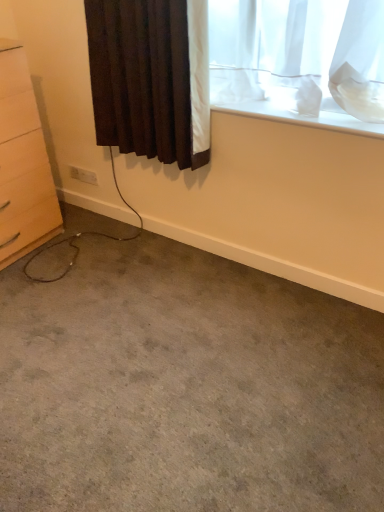
Question: Is white matte window sill at upper right thinner than brown textured curtain at upper left?

Choices:
 (A) no
 (B) yes

Answer: (A)

Question: From a real-world perspective, is white matte window sill at upper right on brown textured curtain at upper left?

Choices:
 (A) yes
 (B) no

Answer: (B)

Question: Considering the relative positions of white matte window sill at upper right and brown textured curtain at upper left in the image provided, is white matte window sill at upper right in front of brown textured curtain at upper left?

Choices:
 (A) yes
 (B) no

Answer: (B)

Question: Can you confirm if white matte window sill at upper right is positioned to the right of brown textured curtain at upper left?

Choices:
 (A) yes
 (B) no

Answer: (A)

Question: Is white matte window sill at upper right positioned with its back to brown textured curtain at upper left?

Choices:
 (A) yes
 (B) no

Answer: (B)

Question: From a real-world perspective, is white matte window sill at upper right below brown textured curtain at upper left?

Choices:
 (A) yes
 (B) no

Answer: (A)

Question: From a real-world perspective, is gray carpet at lower center located beneath light wood chest of drawers at left?

Choices:
 (A) yes
 (B) no

Answer: (A)

Question: Is gray carpet at lower center to the right of light wood chest of drawers at left from the viewer's perspective?

Choices:
 (A) yes
 (B) no

Answer: (A)

Question: From the image's perspective, does gray carpet at lower center appear lower than light wood chest of drawers at left?

Choices:
 (A) no
 (B) yes

Answer: (B)

Question: From a real-world perspective, is gray carpet at lower center on top of light wood chest of drawers at left?

Choices:
 (A) yes
 (B) no

Answer: (B)

Question: Considering the relative sizes of gray carpet at lower center and light wood chest of drawers at left in the image provided, is gray carpet at lower center taller than light wood chest of drawers at left?

Choices:
 (A) yes
 (B) no

Answer: (B)

Question: Is light wood chest of drawers at left a part of gray carpet at lower center?

Choices:
 (A) yes
 (B) no

Answer: (B)

Question: Considering the relative sizes of white plastic electric outlet at lower left and gray carpet at lower center in the image provided, is white plastic electric outlet at lower left smaller than gray carpet at lower center?

Choices:
 (A) no
 (B) yes

Answer: (B)